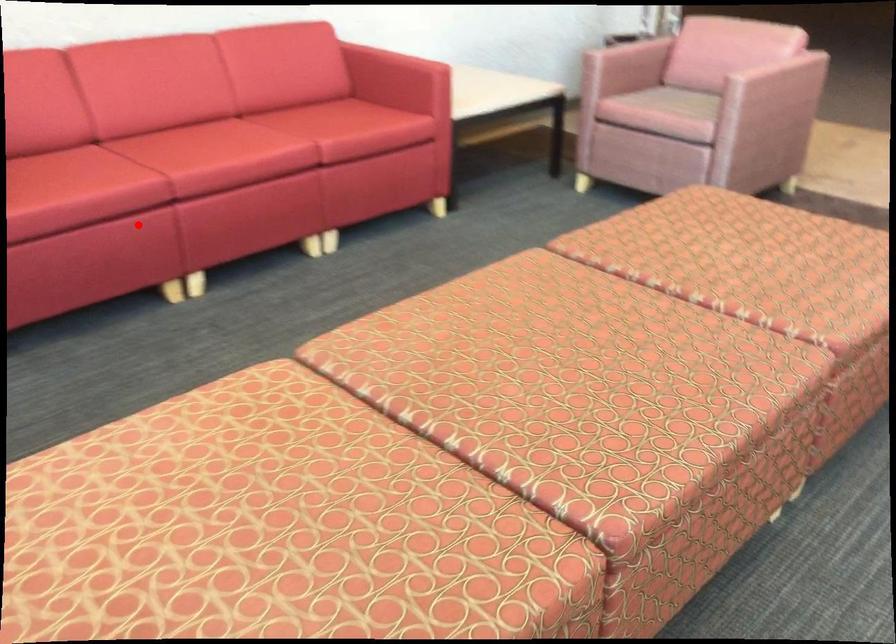
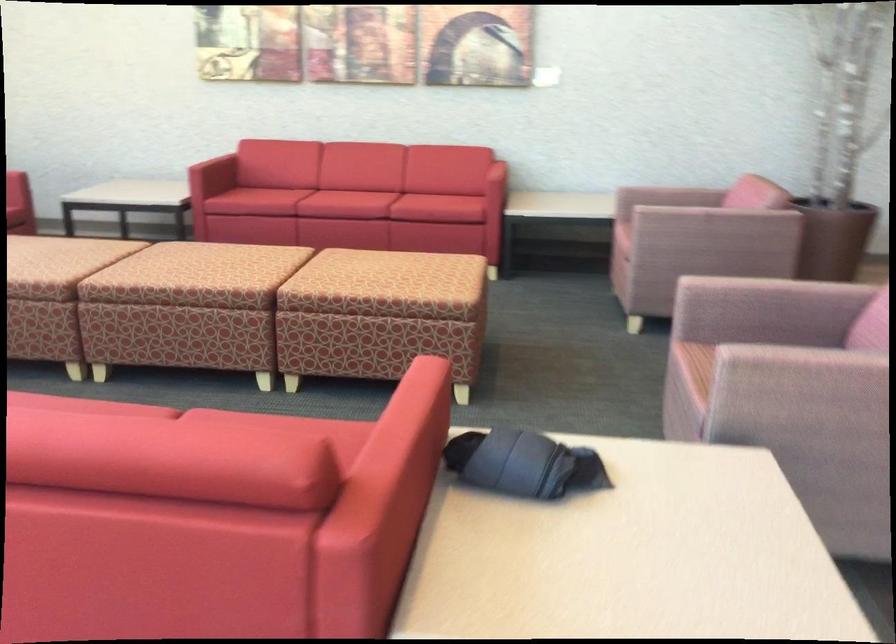
Find the pixel in the second image that matches the highlighted location in the first image.

(265, 200)